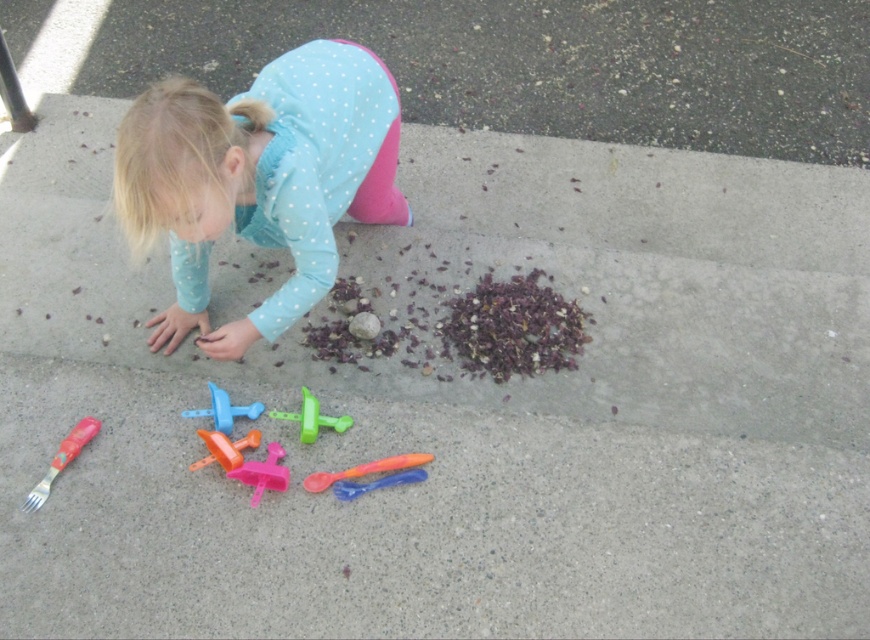
Can you confirm if orange plastic spoon at lower center is positioned to the left of translucent orange plastic toy at center?

Incorrect, orange plastic spoon at lower center is not on the left side of translucent orange plastic toy at center.

Between orange plastic spoon at lower center and translucent orange plastic toy at center, which one is positioned lower?

orange plastic spoon at lower center

Describe the element at coordinates (365, 468) in the screenshot. I see `orange plastic spoon at lower center` at that location.

The image size is (870, 640). I want to click on orange plastic spoon at lower center, so click(365, 468).

How much distance is there between green plastic spoon at lower center and translucent orange plastic toy at center?

5.73 inches

Is green plastic spoon at lower center positioned at the back of translucent orange plastic toy at center?

That is True.

Describe the element at coordinates (312, 419) in the screenshot. This screenshot has height=640, width=870. I see `green plastic spoon at lower center` at that location.

The width and height of the screenshot is (870, 640). Find the location of `green plastic spoon at lower center`. green plastic spoon at lower center is located at coordinates (312, 419).

Does pink plastic toy at lower center appear on the right side of translucent orange plastic toy at center?

Correct, you'll find pink plastic toy at lower center to the right of translucent orange plastic toy at center.

Where is `pink plastic toy at lower center`? The image size is (870, 640). pink plastic toy at lower center is located at coordinates (263, 472).